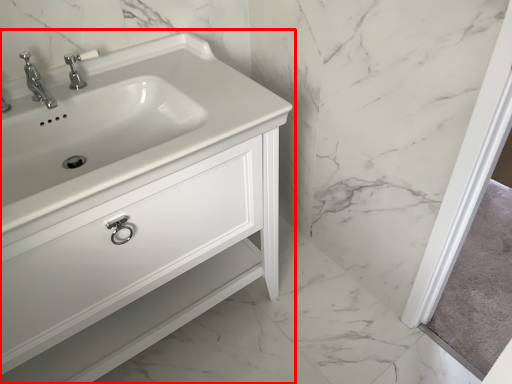
Question: From the image's perspective, where is bathroom cabinet (annotated by the red box) located relative to tap?

Choices:
 (A) below
 (B) above

Answer: (A)